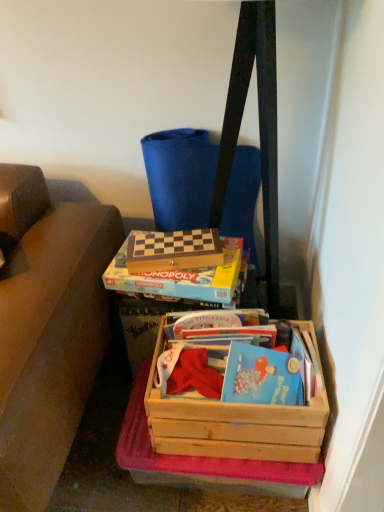
At what (x,y) coordinates should I click in order to perform the action: click on vacant space situated above wooden chessboard at center, positioned as the 3th box in bottom-to-top order (from a real-world perspective). Please return your answer as a coordinate pair (x, y). Looking at the image, I should click on (168, 241).